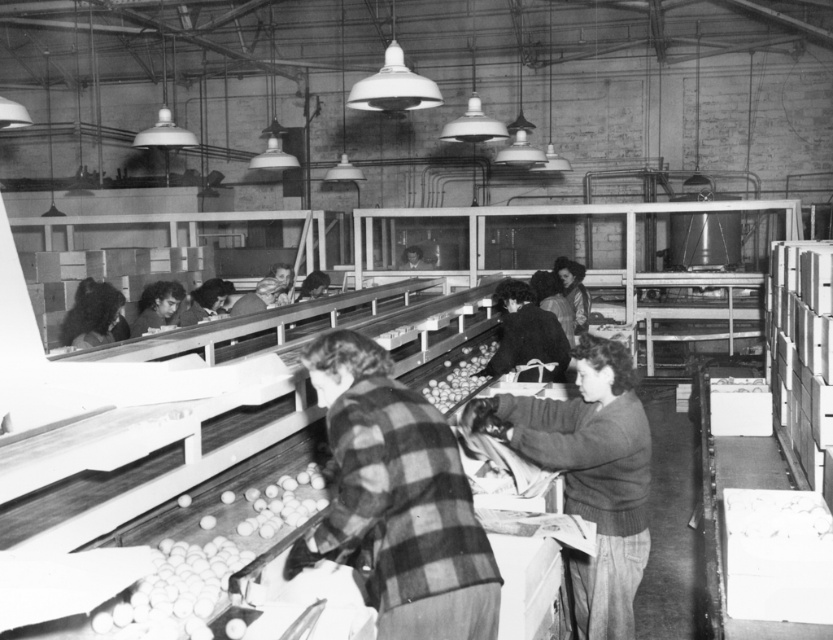
Who is more distant from viewer, (601, 557) or (546, 348)?

Point (546, 348)

Does dark brown sweater at center appear on the right side of plaid shirt at center?

In fact, dark brown sweater at center is to the left of plaid shirt at center.

Based on the photo, who is more distant from viewer, (x=604, y=451) or (x=552, y=362)?

Point (x=552, y=362)

This screenshot has height=640, width=833. What are the coordinates of `dark brown sweater at center` in the screenshot? It's located at (589, 476).

Who is shorter, checkered fabric shirt at center or plaid shirt at center?

plaid shirt at center

How distant is checkered fabric shirt at center from plaid shirt at center?

checkered fabric shirt at center is 3.09 meters from plaid shirt at center.

This screenshot has height=640, width=833. Identify the location of checkered fabric shirt at center. (398, 499).

Is dark brown sweater at center below smooth brown potatoes at center?

Yes.

Does dark brown sweater at center have a larger size compared to smooth brown potatoes at center?

Indeed, dark brown sweater at center has a larger size compared to smooth brown potatoes at center.

The image size is (833, 640). In order to click on dark brown sweater at center in this screenshot , I will do `click(589, 476)`.